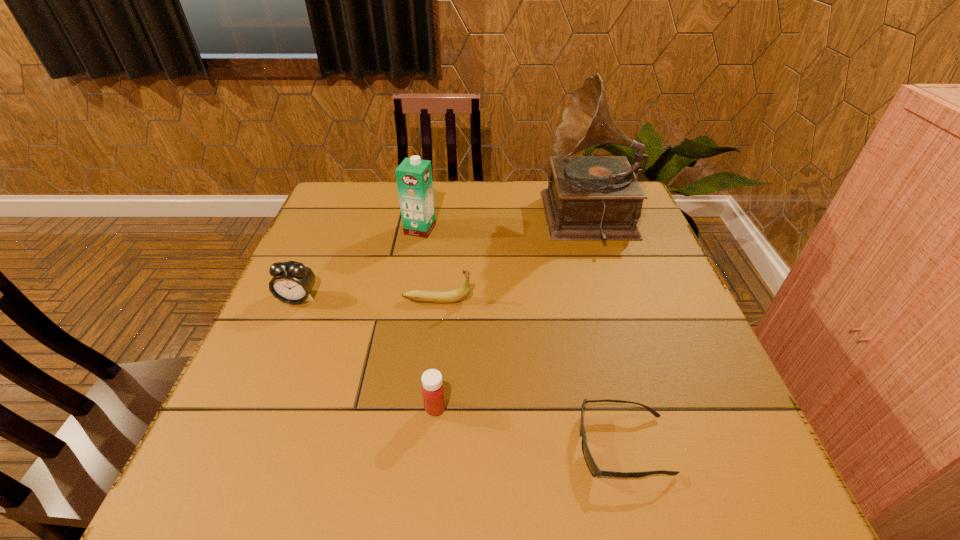
At what (x,y) coordinates should I click in order to perform the action: click on record player. Please return your answer as a coordinate pair (x, y). Image resolution: width=960 pixels, height=540 pixels. Looking at the image, I should click on (589, 198).

This screenshot has height=540, width=960. I want to click on carton, so click(x=414, y=176).

Find the location of `alarm clock`. alarm clock is located at coordinates (292, 282).

Where is `banana`? This screenshot has height=540, width=960. banana is located at coordinates (462, 292).

The width and height of the screenshot is (960, 540). What are the coordinates of `medicine` in the screenshot? It's located at 433,391.

Locate an element on the screen. The image size is (960, 540). the shortest object is located at coordinates pos(593,468).

The image size is (960, 540). I want to click on vacant space located from the horn of the tallest object, so click(485, 220).

You are a GUI agent. You are given a task and a screenshot of the screen. Output one action in this format:
    pyautogui.click(x=<x>, y=<y>)
    Task: Click on the free space located from the horn of the tallest object
    The width and height of the screenshot is (960, 540).
    Given the screenshot: What is the action you would take?
    pyautogui.click(x=446, y=220)

This screenshot has width=960, height=540. I want to click on vacant space located 0.090m from the horn of the tallest object, so click(x=516, y=220).

The image size is (960, 540). Find the location of `free region located 0.370m on the right of the fifth shortest object`. free region located 0.370m on the right of the fifth shortest object is located at coordinates (565, 230).